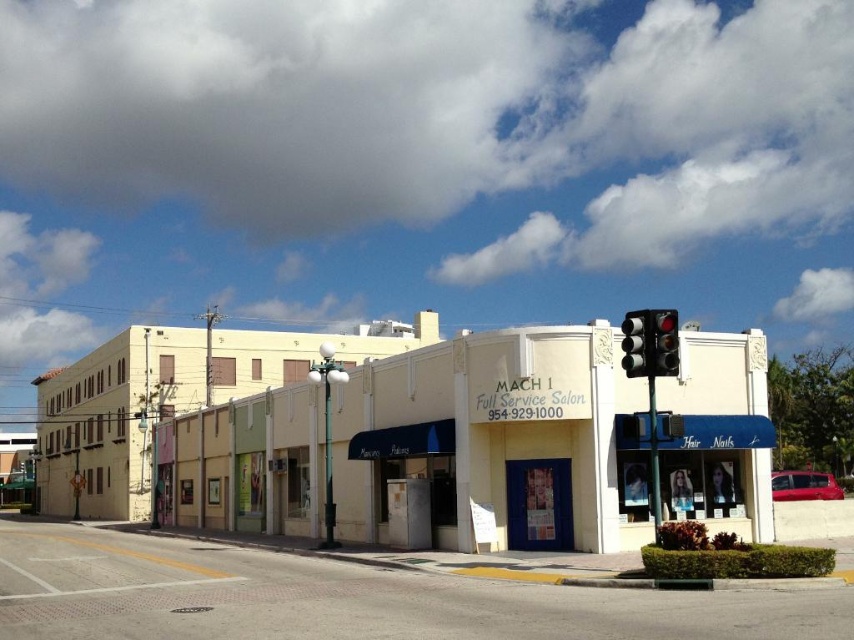
Is metallic traffic light at upper right to the right of red glass traffic light at upper right from the viewer's perspective?

In fact, metallic traffic light at upper right is to the left of red glass traffic light at upper right.

This screenshot has height=640, width=854. What do you see at coordinates (650, 342) in the screenshot? I see `metallic traffic light at upper right` at bounding box center [650, 342].

Is point (645, 372) positioned in front of point (674, 340)?

No.

Find the location of `metallic traffic light at upper right`. metallic traffic light at upper right is located at coordinates (650, 342).

Does red glass traffic light at upper right have a smaller size compared to black glass traffic light at upper right?

Yes.

Measure the distance from red glass traffic light at upper right to black glass traffic light at upper right.

They are 22.71 meters apart.

Find the location of a particular element. This screenshot has height=640, width=854. red glass traffic light at upper right is located at coordinates (664, 342).

Is beige concrete mach 1 full service salon at center shorter than red glass traffic light at upper right?

Incorrect, beige concrete mach 1 full service salon at center's height does not fall short of red glass traffic light at upper right's.

Which is in front, point (585, 506) or point (654, 372)?

Point (654, 372) is more forward.

Between point (747, 508) and point (658, 332), which one is positioned in front?

Point (658, 332)

Locate an element on the screen. Image resolution: width=854 pixels, height=640 pixels. beige concrete mach 1 full service salon at center is located at coordinates (496, 442).